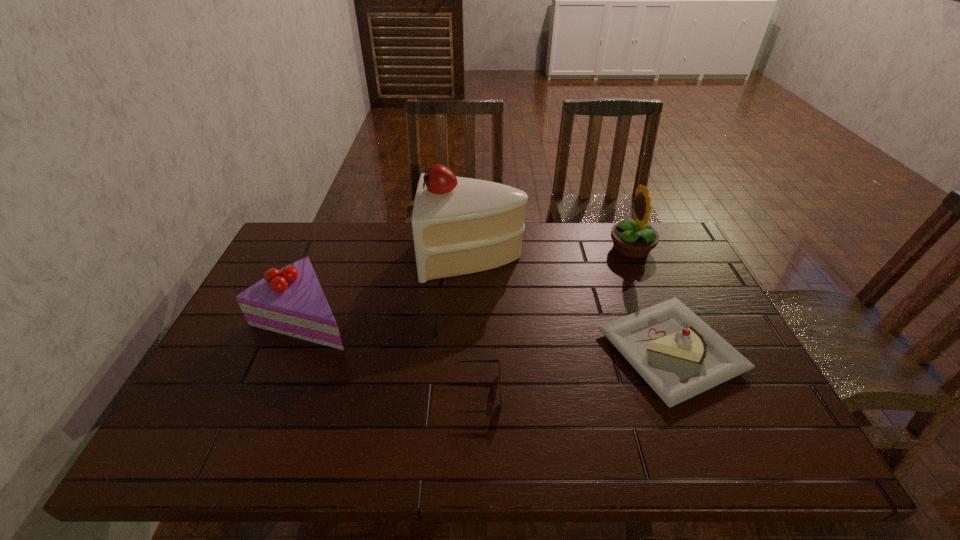
Identify the location of object present at the far right corner. (632, 239).

Where is `free space at the far edge of the desktop`? free space at the far edge of the desktop is located at coordinates (392, 265).

Find the location of `vacant region at the near edge of the desktop`. vacant region at the near edge of the desktop is located at coordinates (356, 445).

You are a GUI agent. You are given a task and a screenshot of the screen. Output one action in this format:
    pyautogui.click(x=<x>, y=<y>)
    Task: Click on the blank space at the left edge
    This screenshot has width=960, height=540.
    Given the screenshot: What is the action you would take?
    pyautogui.click(x=228, y=413)

I want to click on free space at the right edge, so click(744, 401).

The width and height of the screenshot is (960, 540). What are the coordinates of `vacant region at the far left corner of the desktop` in the screenshot? It's located at (321, 250).

Find the location of a particular element. This screenshot has width=960, height=540. free space at the near left corner of the desktop is located at coordinates (194, 433).

You are a GUI agent. You are given a task and a screenshot of the screen. Output one action in this format:
    pyautogui.click(x=<x>, y=<y>)
    Task: Click on the vacant space at the near right corner of the desktop
    
    Given the screenshot: What is the action you would take?
    pyautogui.click(x=748, y=444)

At what (x,y) coordinates should I click in order to perform the action: click on free space between the tallest cake and the second shortest cake. Please return your answer as a coordinate pair (x, y). Looking at the image, I should click on (389, 285).

You are a GUI agent. You are given a task and a screenshot of the screen. Output one action in this format:
    pyautogui.click(x=<x>, y=<y>)
    Task: Click on the vacant space in between the farthest cake and the second tallest cake
    The image size is (960, 540).
    Given the screenshot: What is the action you would take?
    pyautogui.click(x=389, y=285)